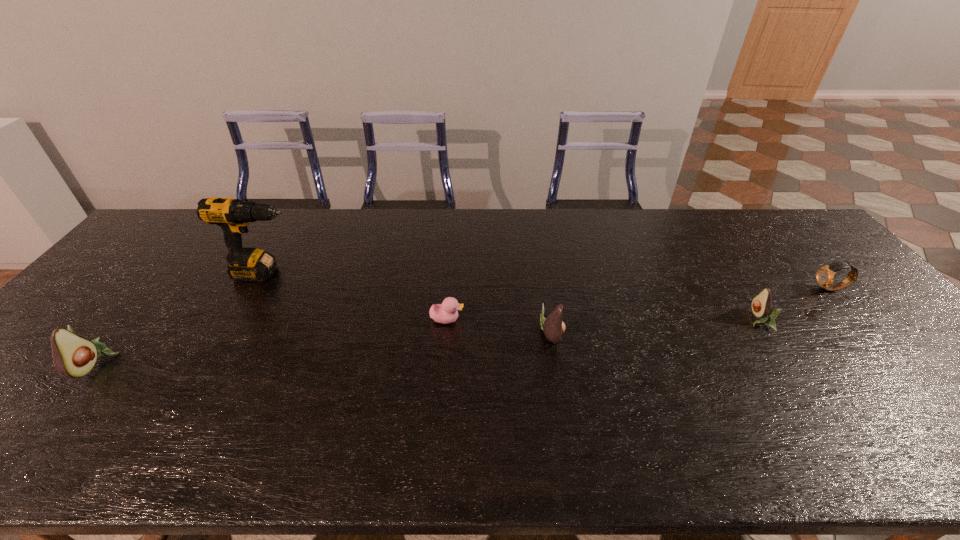
The width and height of the screenshot is (960, 540). I want to click on the rightmost object, so click(x=825, y=275).

This screenshot has height=540, width=960. Find the location of `vacant space located on the seed side of the leftmost object`. vacant space located on the seed side of the leftmost object is located at coordinates (230, 363).

This screenshot has width=960, height=540. Identify the location of vacant region located 0.350m on the seed side of the second tallest avocado. (699, 334).

The height and width of the screenshot is (540, 960). What are the coordinates of `free space located 0.200m on the seed side of the rightmost avocado` in the screenshot? It's located at (675, 320).

I want to click on vacant space located 0.230m on the seed side of the rightmost avocado, so click(663, 320).

The image size is (960, 540). Find the location of `free space located on the seed side of the rightmost avocado`. free space located on the seed side of the rightmost avocado is located at coordinates (615, 320).

Locate an element on the screen. The width and height of the screenshot is (960, 540). vacant area situated on the front-facing side of the duckling is located at coordinates (572, 320).

Identify the location of free space located at the tip of the tallest object. This screenshot has height=540, width=960. (389, 274).

Locate an element on the screen. free space located on the face of the rightmost object is located at coordinates (787, 289).

Locate an element on the screen. free spot located 0.130m on the face of the rightmost object is located at coordinates (770, 289).